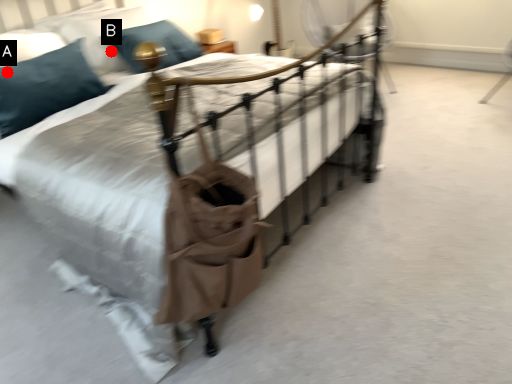
Question: Two points are circled on the image, labeled by A and B beside each circle. Which point is farther from the camera taking this photo?

Choices:
 (A) A is further
 (B) B is further

Answer: (B)